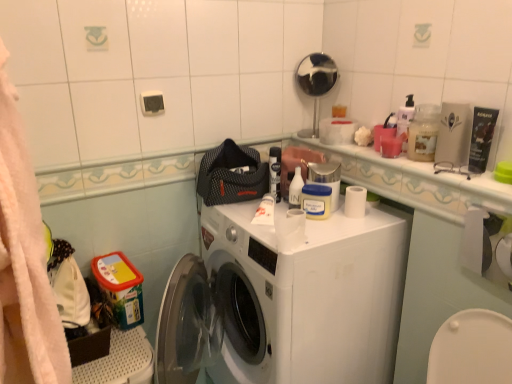
The image size is (512, 384). In order to click on vacant area that is in front of pink matte candle at upper right, the second toiletry when ordered from right to left in this screenshot , I will do `click(415, 170)`.